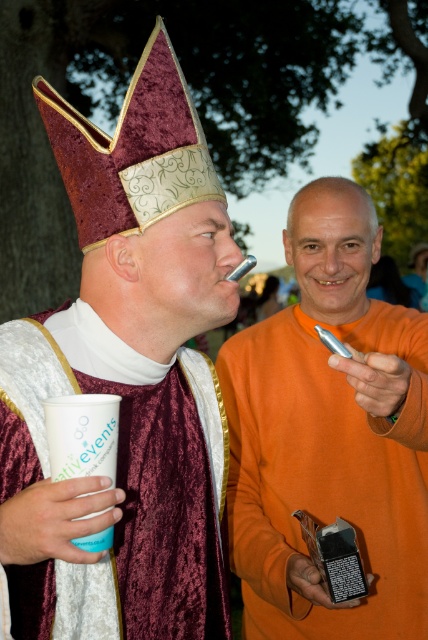
Consider the image. You are a photographer at the event and need to position the two subjects so that their heights are balanced in the photo. Given that the orange matte shirt at center and the velvet maroon robe at center are present, which subject should you place closer to the camera to achieve this balance?

The orange matte shirt at center is taller than the velvet maroon robe at center. To balance their heights in the photo, place the shorter velvet maroon robe at center closer to the camera while positioning the taller orange matte shirt at center further back. This adjustment will visually equalize their sizes in the frame.

From the picture: You are organizing a costume party and need to arrange two outfits for display. The outfits are the orange matte shirt at center and the velvet maroon robe at center. Which outfit takes up more horizontal space when displayed side by side?

The orange matte shirt at center takes up more horizontal space because its width surpasses that of the velvet maroon robe at center.

You are a photographer trying to capture a group photo of the two people in the scene. The scene requires that everyone must stand within a 1.5 meter radius of the center point. Given that the orange matte shirt at center is already positioned at point 0.680, 0.769, can you confirm if the other person is within the required radius?

The orange matte shirt at center is positioned at point (329,435). Since the other person is not mentioned in the objects description, their position cannot be determined. Therefore, it is unknown if they are within the 1.5 meter radius.